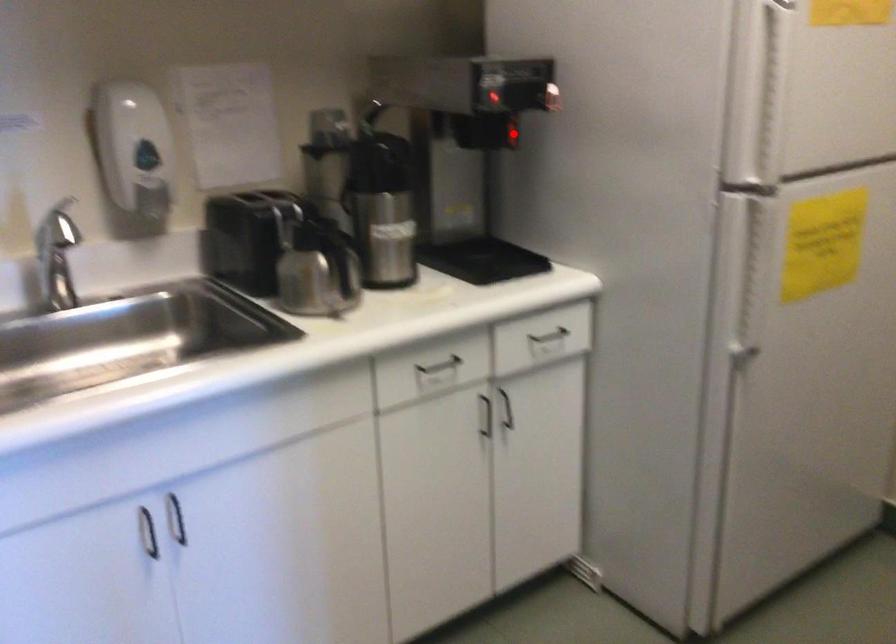
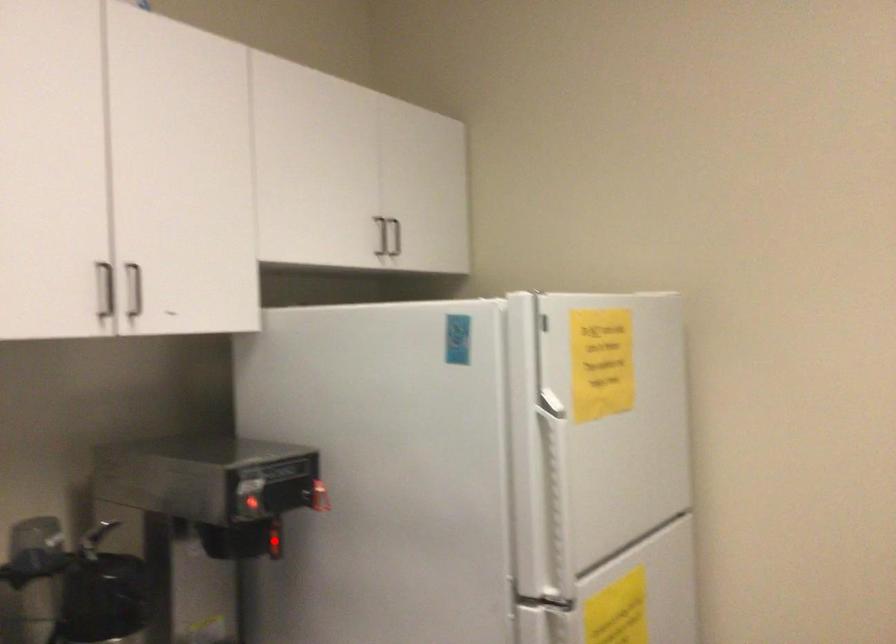
I am providing you with two images of the same scene from different viewpoints. A red point is marked on the first image and another point is marked on the second image. Is the red point in image1 aligned with the point shown in image2?

Yes